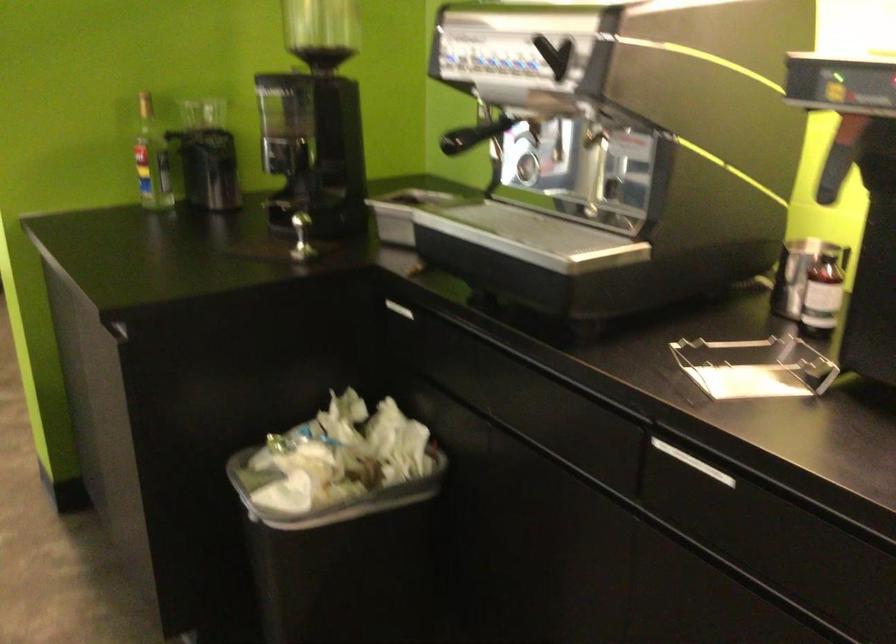
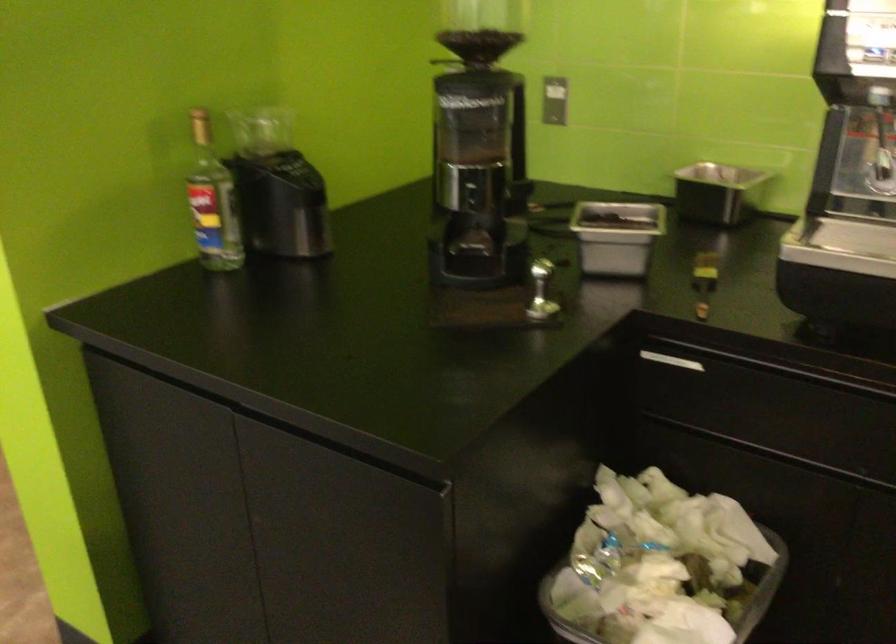
Which direction would the cameraman need to move to produce the second image?

The cameraman walked toward left, forward.